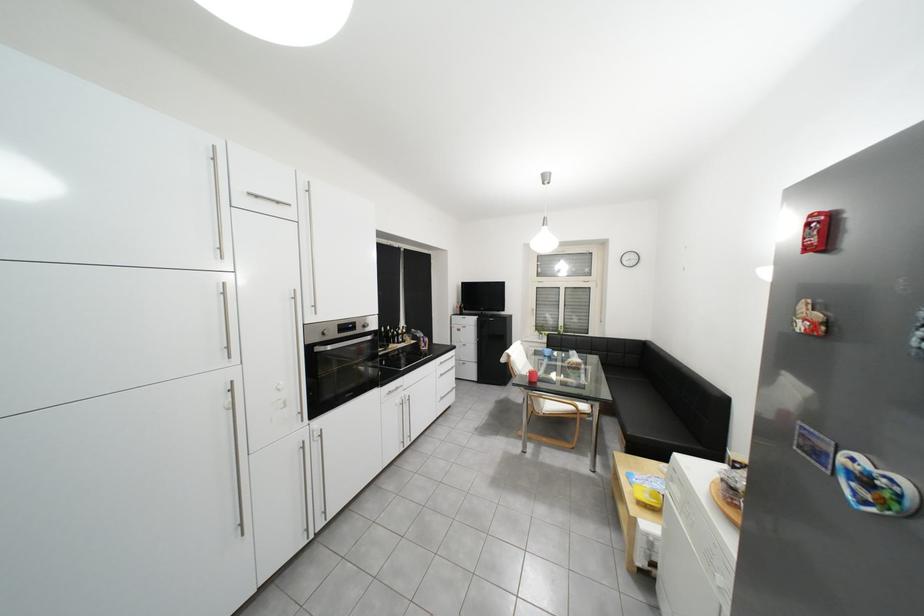
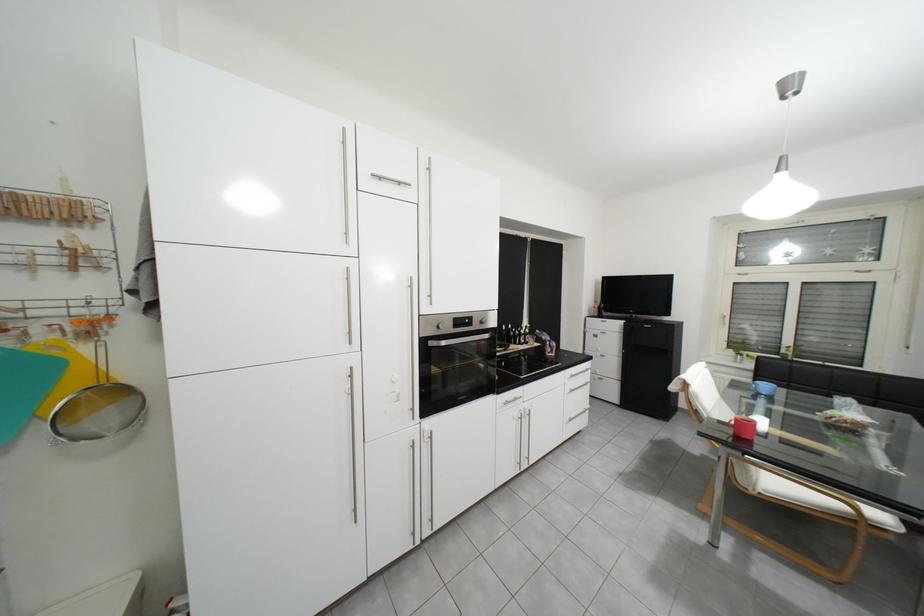
Question: What movement of the cameraman would produce the second image?

Choices:
 (A) Left
 (B) Right
 (C) Forward
 (D) Backward

Answer: (C)